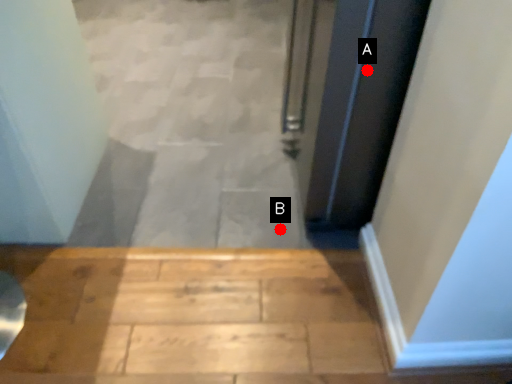
Question: Two points are circled on the image, labeled by A and B beside each circle. Which point appears closest to the camera in this image?

Choices:
 (A) A is closer
 (B) B is closer

Answer: (A)